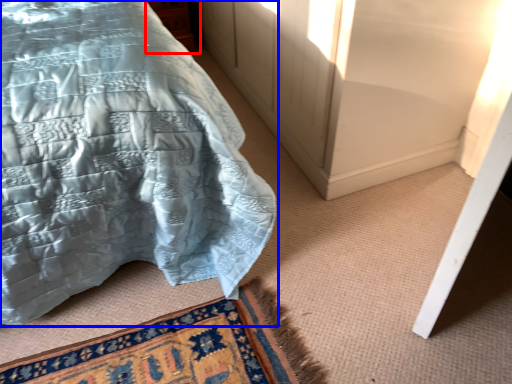
Question: Among these objects, which one is farthest to the camera, cabinetry (highlighted by a red box) or bed (highlighted by a blue box)?

Choices:
 (A) cabinetry
 (B) bed

Answer: (A)